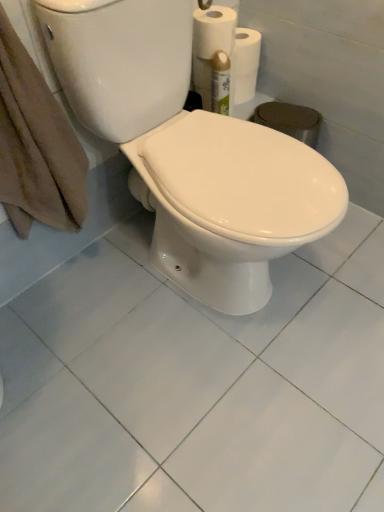
Question: Is brown cotton towel at left facing away from white glossy toilet at center?

Choices:
 (A) yes
 (B) no

Answer: (B)

Question: Can we say brown cotton towel at left lies outside white glossy toilet at center?

Choices:
 (A) no
 (B) yes

Answer: (B)

Question: Is brown cotton towel at left with white glossy toilet at center?

Choices:
 (A) yes
 (B) no

Answer: (B)

Question: Is the position of brown cotton towel at left more distant than that of white glossy toilet at center?

Choices:
 (A) yes
 (B) no

Answer: (A)

Question: Does brown cotton towel at left have a lesser width compared to white glossy toilet at center?

Choices:
 (A) no
 (B) yes

Answer: (B)

Question: Does point (147, 31) appear closer or farther from the camera than point (39, 137)?

Choices:
 (A) closer
 (B) farther

Answer: (A)

Question: From the image's perspective, is white glossy toilet at center positioned above or below brown cotton towel at left?

Choices:
 (A) above
 (B) below

Answer: (B)

Question: Visually, is white glossy toilet at center positioned to the left or to the right of brown cotton towel at left?

Choices:
 (A) right
 (B) left

Answer: (A)

Question: From a real-world perspective, relative to brown cotton towel at left, is white glossy toilet at center vertically above or below?

Choices:
 (A) below
 (B) above

Answer: (A)

Question: From their relative heights in the image, would you say white glossy toilet at center is taller or shorter than white glossy ceramic tile at center?

Choices:
 (A) short
 (B) tall

Answer: (B)

Question: From a real-world perspective, is white glossy toilet at center above or below white glossy ceramic tile at center?

Choices:
 (A) below
 (B) above

Answer: (B)

Question: Would you say white glossy toilet at center is to the left or to the right of white glossy ceramic tile at center in the picture?

Choices:
 (A) left
 (B) right

Answer: (A)

Question: Considering the positions of white glossy toilet at center and white glossy ceramic tile at center in the image, is white glossy toilet at center bigger or smaller than white glossy ceramic tile at center?

Choices:
 (A) small
 (B) big

Answer: (B)

Question: Looking at their shapes, would you say brown cotton towel at left is wider or thinner than white glossy toilet at center?

Choices:
 (A) thin
 (B) wide

Answer: (A)

Question: Considering the relative positions of brown cotton towel at left and white glossy toilet at center in the image provided, is brown cotton towel at left to the left or to the right of white glossy toilet at center?

Choices:
 (A) left
 (B) right

Answer: (A)